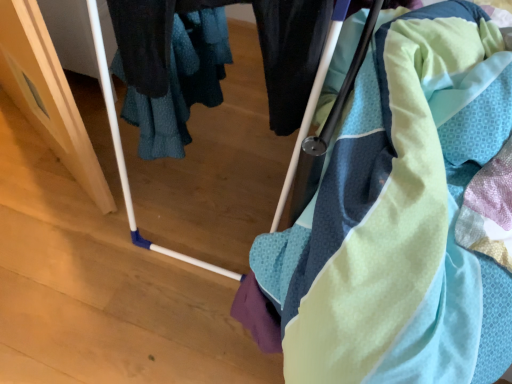
Describe the element at coordinates (122, 149) in the screenshot. The height and width of the screenshot is (384, 512). I see `matte plastic baby carriage at center` at that location.

You are a GUI agent. You are given a task and a screenshot of the screen. Output one action in this format:
    pyautogui.click(x=<x>, y=<y>)
    Task: Click on the matte plastic baby carriage at center
    The image size is (512, 384).
    Given the screenshot: What is the action you would take?
    pyautogui.click(x=122, y=149)

The height and width of the screenshot is (384, 512). Identify the location of textured cotton towel at center. (401, 217).

What do you see at coordinates (401, 217) in the screenshot? I see `textured cotton towel at center` at bounding box center [401, 217].

This screenshot has width=512, height=384. In order to click on matte plastic baby carriage at center in this screenshot , I will do `click(122, 149)`.

Is textured cotton towel at center to the left of matte plastic baby carriage at center from the viewer's perspective?

Yes.

Is textured cotton towel at center positioned in front of matte plastic baby carriage at center?

No, textured cotton towel at center is further to the viewer.

Which point is more distant from viewer, (488, 70) or (336, 20)?

The point (336, 20) is farther from the camera.

From the image's perspective, is textured cotton towel at center on matte plastic baby carriage at center?

No, from the image's perspective, textured cotton towel at center is not over matte plastic baby carriage at center.

From a real-world perspective, is textured cotton towel at center located beneath matte plastic baby carriage at center?

Yes, from a real-world perspective, textured cotton towel at center is beneath matte plastic baby carriage at center.

In terms of width, does textured cotton towel at center look wider or thinner when compared to matte plastic baby carriage at center?

Clearly, textured cotton towel at center has more width compared to matte plastic baby carriage at center.

Considering the relative sizes of textured cotton towel at center and matte plastic baby carriage at center in the image provided, is textured cotton towel at center taller than matte plastic baby carriage at center?

No.

Considering the sizes of textured cotton towel at center and matte plastic baby carriage at center in the image, is textured cotton towel at center bigger or smaller than matte plastic baby carriage at center?

textured cotton towel at center is smaller than matte plastic baby carriage at center.

Is matte plastic baby carriage at center a part of textured cotton towel at center?

Definitely not — matte plastic baby carriage at center is not inside textured cotton towel at center.

Is textured cotton towel at center touching matte plastic baby carriage at center?

textured cotton towel at center and matte plastic baby carriage at center are not in contact.

From the picture: Is textured cotton towel at center aimed at matte plastic baby carriage at center?

Yes, textured cotton towel at center faces towards matte plastic baby carriage at center.

Identify the location of towel below the matte plastic baby carriage at center (from a real-world perspective). (401, 217).

Considering the positions of objects matte plastic baby carriage at center and textured cotton towel at center in the image provided, who is more to the right, matte plastic baby carriage at center or textured cotton towel at center?

Positioned to the right is matte plastic baby carriage at center.

Between matte plastic baby carriage at center and textured cotton towel at center, which one is positioned in front?

matte plastic baby carriage at center.

Based on the photo, which is more distant, (343,5) or (476,102)?

The point (343,5) is farther.

From the picture: From the image's perspective, would you say matte plastic baby carriage at center is positioned over textured cotton towel at center?

Yes, from the image's perspective, matte plastic baby carriage at center is over textured cotton towel at center.

From a real-world perspective, which object rests below the other?

In real-world perspective, textured cotton towel at center is lower.

Considering the sizes of objects matte plastic baby carriage at center and textured cotton towel at center in the image provided, who is thinner, matte plastic baby carriage at center or textured cotton towel at center?

Thinner between the two is matte plastic baby carriage at center.

Is matte plastic baby carriage at center taller than textured cotton towel at center?

Indeed, matte plastic baby carriage at center has a greater height compared to textured cotton towel at center.

Considering the relative sizes of matte plastic baby carriage at center and textured cotton towel at center in the image provided, is matte plastic baby carriage at center smaller than textured cotton towel at center?

Actually, matte plastic baby carriage at center might be larger than textured cotton towel at center.

Is matte plastic baby carriage at center not inside textured cotton towel at center?

Yes, matte plastic baby carriage at center is outside of textured cotton towel at center.

Would you consider matte plastic baby carriage at center to be distant from textured cotton towel at center?

That's not correct — matte plastic baby carriage at center is a little close to textured cotton towel at center.

Is matte plastic baby carriage at center positioned with its back to textured cotton towel at center?

No, textured cotton towel at center is not at the back of matte plastic baby carriage at center.

In the scene shown: How many degrees apart are the facing directions of matte plastic baby carriage at center and textured cotton towel at center?

There is a 178-degree angle between the facing directions of matte plastic baby carriage at center and textured cotton towel at center.

How far apart are matte plastic baby carriage at center and textured cotton towel at center?

They are 27.09 inches apart.

Where is `towel below the matte plastic baby carriage at center (from a real-world perspective)`? towel below the matte plastic baby carriage at center (from a real-world perspective) is located at coordinates (401, 217).

Find the location of a particular element. Image resolution: width=512 pixels, height=384 pixels. towel lying below the matte plastic baby carriage at center (from the image's perspective) is located at coordinates (401, 217).

At what (x,y) coordinates should I click in order to perform the action: click on baby carriage that appears above the textured cotton towel at center (from the image's perspective). Please return your answer as a coordinate pair (x, y). Looking at the image, I should click on (122, 149).